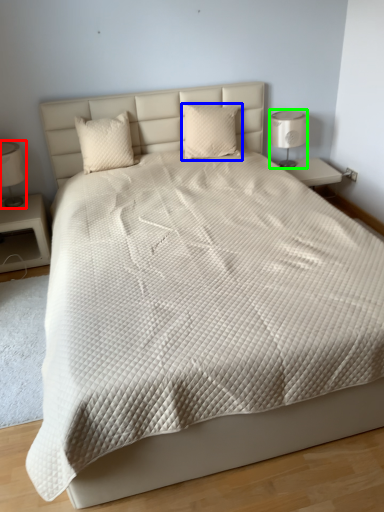
Question: Estimate the real-world distances between objects in this image. Which object is closer to bedside lamp (highlighted by a red box), pillow (highlighted by a blue box) or bedside lamp (highlighted by a green box)?

Choices:
 (A) pillow
 (B) bedside lamp

Answer: (A)